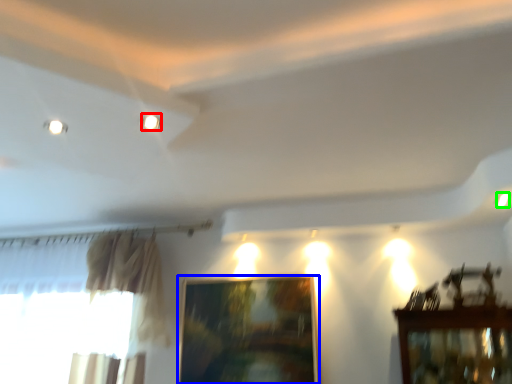
Question: Based on their relative distances, which object is nearer to lighting (highlighted by a red box)? Choose from picture frame (highlighted by a blue box) and light (highlighted by a green box).

Choices:
 (A) picture frame
 (B) light

Answer: (B)